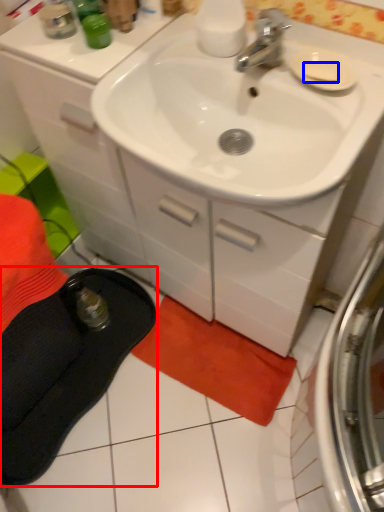
Question: Which object is further to the camera taking this photo, slipper (highlighted by a red box) or soap (highlighted by a blue box)?

Choices:
 (A) slipper
 (B) soap

Answer: (A)